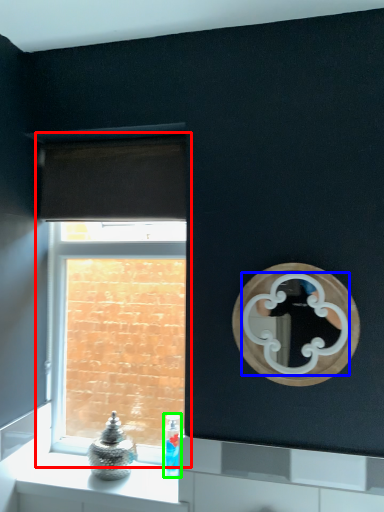
Question: Which object is positioned farthest from window (highlighted by a red box)? Select from mirror (highlighted by a blue box) and toiletry (highlighted by a green box).

Choices:
 (A) mirror
 (B) toiletry

Answer: (A)